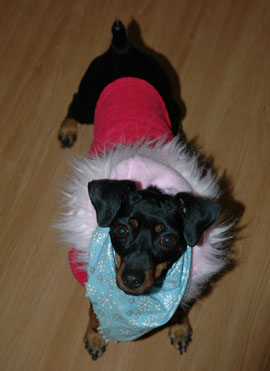
Find the location of a particular element. floor is located at coordinates click(x=49, y=305).